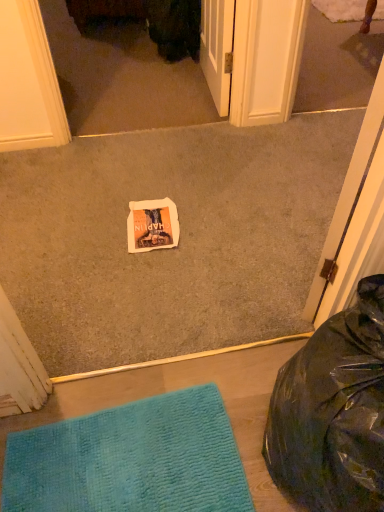
Question: Is white paper at center far away from matte white screen door at upper center?

Choices:
 (A) yes
 (B) no

Answer: (B)

Question: From a real-world perspective, is white paper at center beneath matte white screen door at upper center?

Choices:
 (A) no
 (B) yes

Answer: (A)

Question: Is white paper at center to the right of matte white screen door at upper center from the viewer's perspective?

Choices:
 (A) no
 (B) yes

Answer: (B)

Question: Is matte white screen door at upper center at the back of white paper at center?

Choices:
 (A) no
 (B) yes

Answer: (B)

Question: Can you confirm if white paper at center is taller than matte white screen door at upper center?

Choices:
 (A) no
 (B) yes

Answer: (B)

Question: Would you say black plastic bean bag chair at lower right is inside or outside white paper at center?

Choices:
 (A) inside
 (B) outside

Answer: (B)

Question: Considering their positions, is black plastic bean bag chair at lower right located in front of or behind white paper at center?

Choices:
 (A) behind
 (B) front

Answer: (B)

Question: Visually, is black plastic bean bag chair at lower right positioned to the left or to the right of white paper at center?

Choices:
 (A) left
 (B) right

Answer: (B)

Question: Considering the positions of black plastic bean bag chair at lower right and white paper at center in the image, is black plastic bean bag chair at lower right bigger or smaller than white paper at center?

Choices:
 (A) small
 (B) big

Answer: (B)

Question: From a real-world perspective, relative to teal textured mat at lower left, is white paper at center vertically above or below?

Choices:
 (A) below
 (B) above

Answer: (B)

Question: Is white paper at center inside the boundaries of teal textured mat at lower left, or outside?

Choices:
 (A) outside
 (B) inside

Answer: (A)

Question: Based on their sizes in the image, would you say white paper at center is bigger or smaller than teal textured mat at lower left?

Choices:
 (A) small
 (B) big

Answer: (A)

Question: Visually, is white paper at center positioned to the left or to the right of teal textured mat at lower left?

Choices:
 (A) right
 (B) left

Answer: (B)

Question: In the image, is white paper at center positioned in front of or behind black plastic bean bag chair at lower right?

Choices:
 (A) front
 (B) behind

Answer: (B)

Question: Based on their sizes in the image, would you say white paper at center is bigger or smaller than black plastic bean bag chair at lower right?

Choices:
 (A) big
 (B) small

Answer: (B)